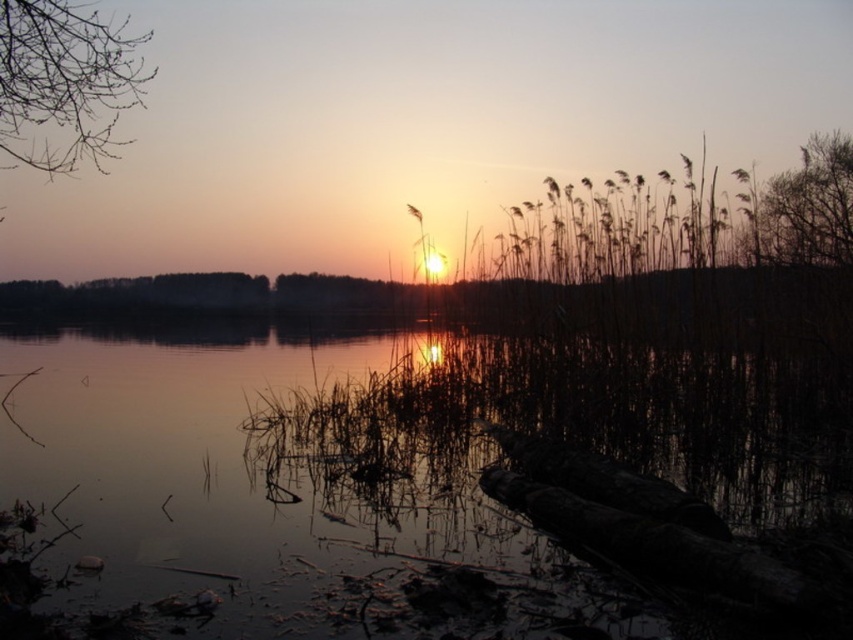
Question: Which object appears closest to the camera in this image?

Choices:
 (A) bare branches at upper left
 (B) transparent water at center

Answer: (B)

Question: Is transparent water at center above bare branches at upper left?

Choices:
 (A) no
 (B) yes

Answer: (A)

Question: Is transparent water at center positioned before bare branches at upper left?

Choices:
 (A) no
 (B) yes

Answer: (B)

Question: Is transparent water at center above bare branches at upper left?

Choices:
 (A) no
 (B) yes

Answer: (A)

Question: Among these objects, which one is farthest from the camera?

Choices:
 (A) transparent water at center
 (B) bare branches at upper left

Answer: (B)